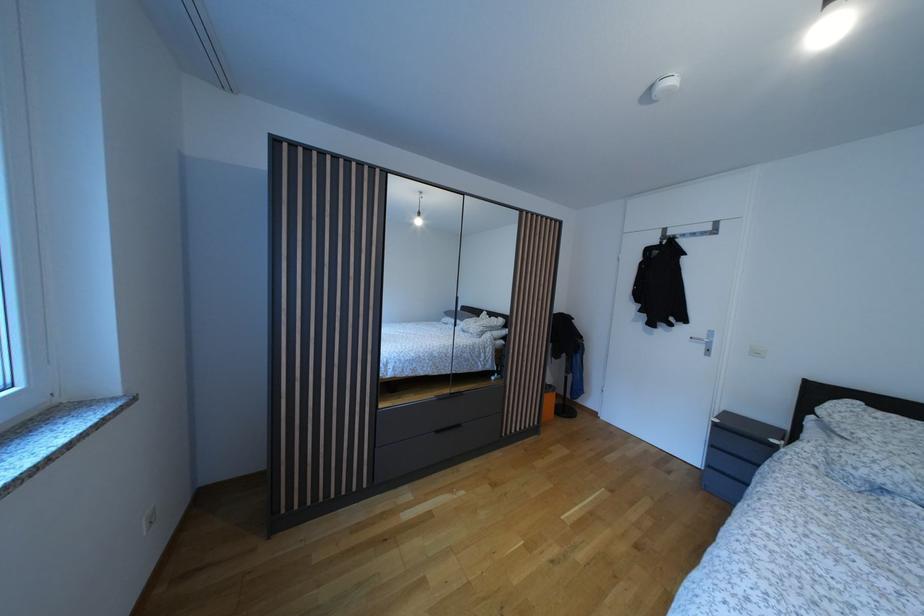
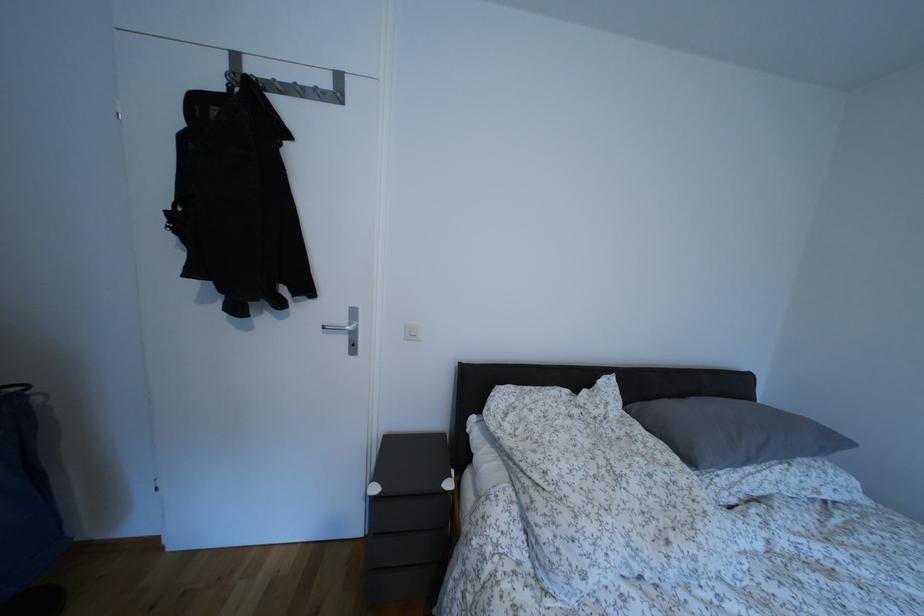
Find the pixel in the second image that matches (709,342) in the first image.

(348, 325)